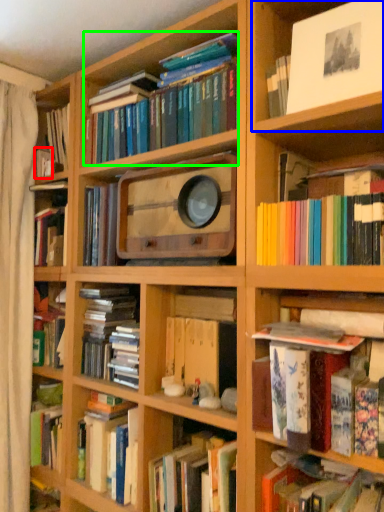
Question: Which object is positioned farthest from book (highlighted by a red box)? Select from cabinet (highlighted by a blue box) and book (highlighted by a green box).

Choices:
 (A) cabinet
 (B) book

Answer: (A)